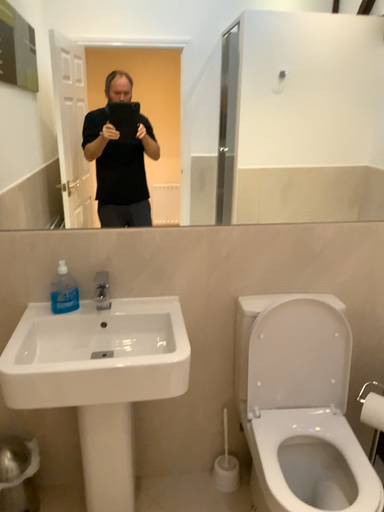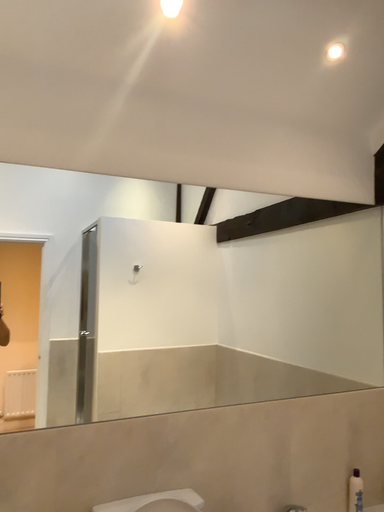
Question: How did the camera likely rotate when shooting the video?

Choices:
 (A) rotated upward
 (B) rotated downward

Answer: (A)